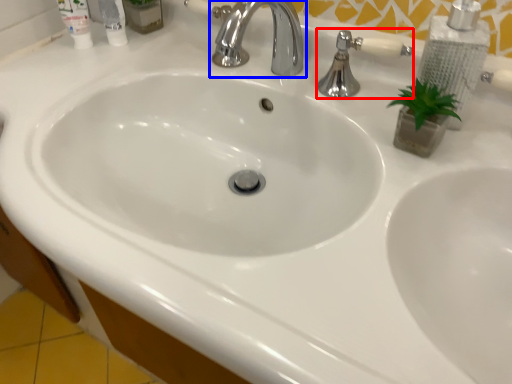
Question: Which of the following is the farthest to the observer, plumbing fixture (highlighted by a red box) or tap (highlighted by a blue box)?

Choices:
 (A) plumbing fixture
 (B) tap

Answer: (A)